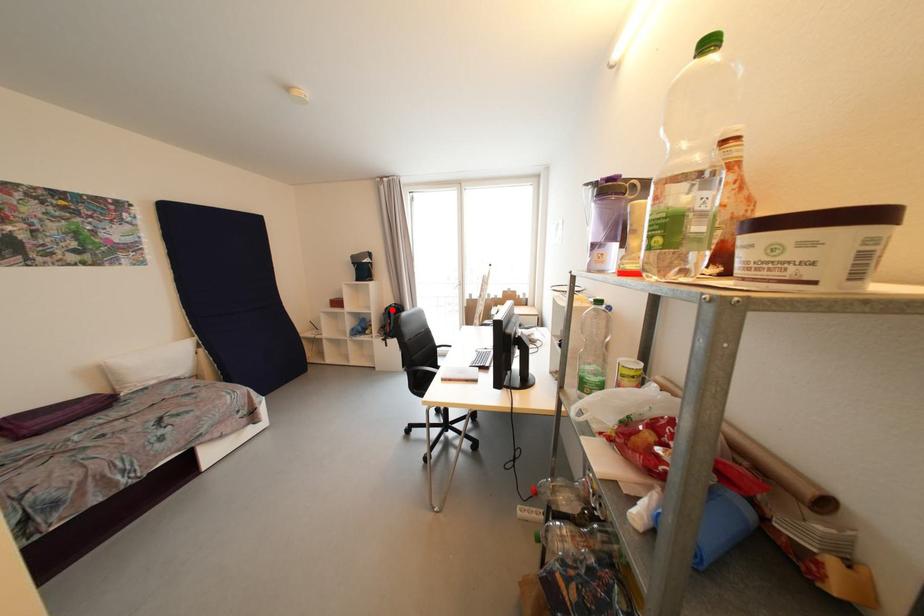
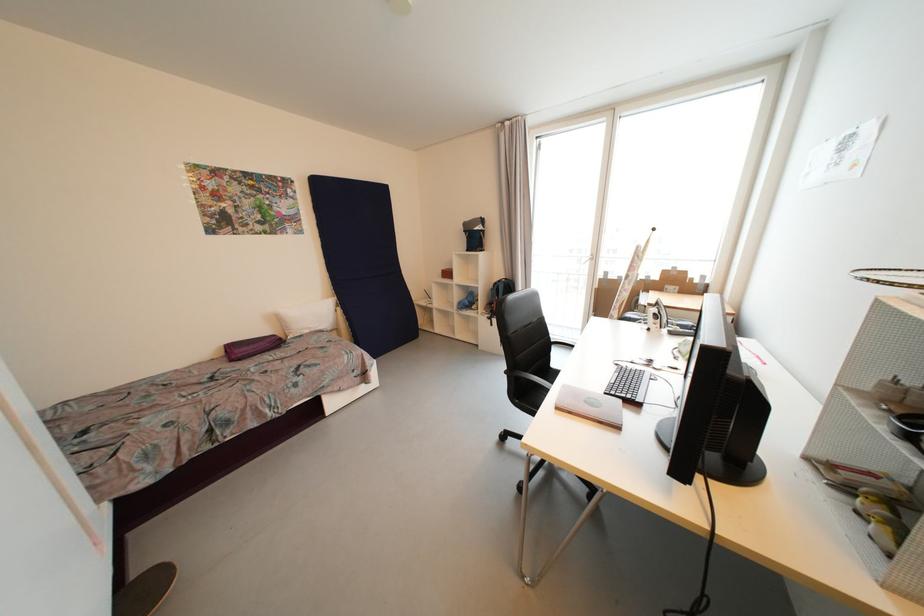
Question: I am providing you with two images of the same scene from different viewpoints. A red point is shown in image1. For the corresponding object point in image2, is it positioned nearer or farther from the camera?

Choices:
 (A) Nearer
 (B) Farther

Answer: (A)